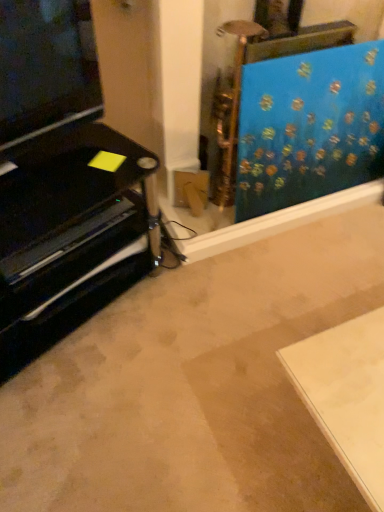
You are a GUI agent. You are given a task and a screenshot of the screen. Output one action in this format:
    pyautogui.click(x=<x>, y=<y>)
    Task: Click on the vacant area that is situated to the right of black glossy entertainment unit at left
    
    Given the screenshot: What is the action you would take?
    pyautogui.click(x=203, y=328)